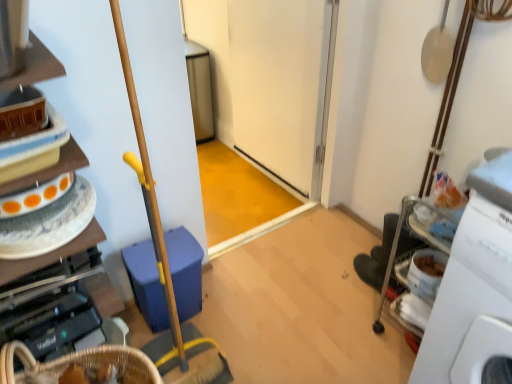
Question: Would you say white plastic machine at right is inside or outside wooden cabinet at left?

Choices:
 (A) outside
 (B) inside

Answer: (A)

Question: From a real-world perspective, relative to wooden cabinet at left, is white plastic machine at right vertically above or below?

Choices:
 (A) above
 (B) below

Answer: (B)

Question: Considering the relative positions of white plastic machine at right and wooden cabinet at left in the image provided, is white plastic machine at right to the left or to the right of wooden cabinet at left?

Choices:
 (A) right
 (B) left

Answer: (A)

Question: Is wooden cabinet at left to the left or to the right of white plastic machine at right in the image?

Choices:
 (A) left
 (B) right

Answer: (A)

Question: In the image, is wooden cabinet at left positioned in front of or behind white plastic machine at right?

Choices:
 (A) behind
 (B) front

Answer: (A)

Question: Is point (112, 311) closer or farther from the camera than point (478, 352)?

Choices:
 (A) farther
 (B) closer

Answer: (A)

Question: Based on their sizes in the image, would you say wooden cabinet at left is bigger or smaller than white plastic machine at right?

Choices:
 (A) big
 (B) small

Answer: (B)